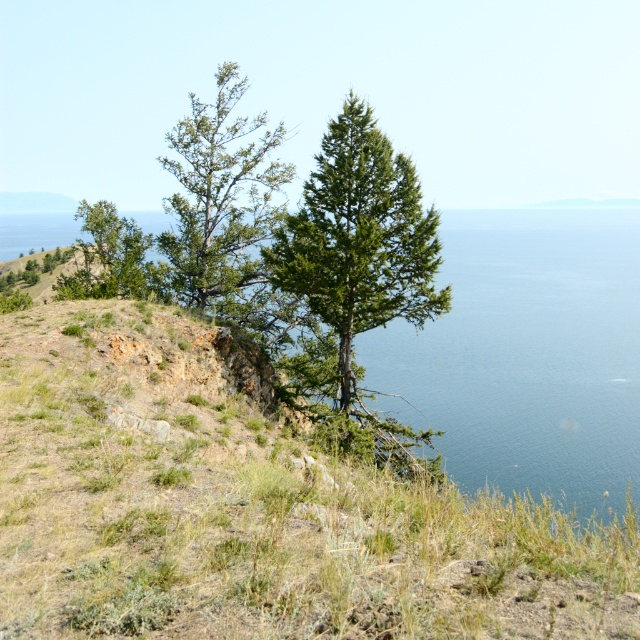
Is green textured tree at upper left taller than green matte tree at upper left?

Indeed, green textured tree at upper left has a greater height compared to green matte tree at upper left.

Who is positioned more to the right, green textured tree at upper left or green matte tree at upper left?

green matte tree at upper left is more to the right.

Which is in front, point (259, 266) or point (106, 250)?

Positioned in front is point (259, 266).

You are a GUI agent. You are given a task and a screenshot of the screen. Output one action in this format:
    pyautogui.click(x=<x>, y=<y>)
    Task: Click on the green textured tree at upper left
    
    Given the screenshot: What is the action you would take?
    pyautogui.click(x=220, y=196)

Who is shorter, green textured tree at center or green matte tree at upper left?

Standing shorter between the two is green matte tree at upper left.

Does point (369, 316) lie behind point (100, 296)?

No.

The height and width of the screenshot is (640, 640). In order to click on green textured tree at center in this screenshot , I will do `click(360, 237)`.

Who is more forward, (349,292) or (216,180)?

→ Point (349,292) is in front.

Is green textured tree at center taller than green textured tree at upper left?

Incorrect, green textured tree at center's height is not larger of green textured tree at upper left's.

Locate an element on the screen. This screenshot has height=640, width=640. green textured tree at center is located at coordinates (360, 237).

You are a GUI agent. You are given a task and a screenshot of the screen. Output one action in this format:
    pyautogui.click(x=<x>, y=<y>)
    Task: Click on the green textured tree at center
    This screenshot has width=640, height=640.
    Given the screenshot: What is the action you would take?
    pyautogui.click(x=360, y=237)